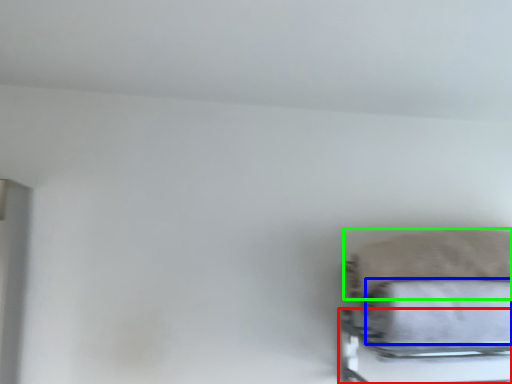
Question: Considering the real-world distances, which object is farthest from bed frame (highlighted by a red box)? bath towel (highlighted by a blue box) or pillow (highlighted by a green box)?

Choices:
 (A) bath towel
 (B) pillow

Answer: (B)